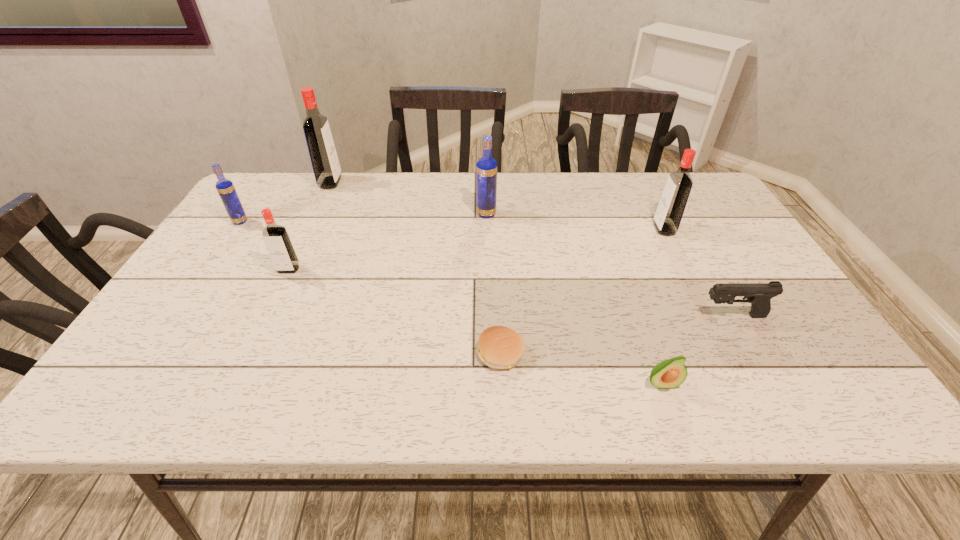
In order to click on empty location between the green avocado and the second biggest red vodka in this screenshot , I will do `click(662, 306)`.

At what (x,y) coordinates should I click in order to perform the action: click on vacant space that is in between the rightmost vodka and the pistol. Please return your answer as a coordinate pair (x, y). The height and width of the screenshot is (540, 960). Looking at the image, I should click on (698, 272).

Find the location of a particular element. The width and height of the screenshot is (960, 540). vacant region between the right blue vodka and the smaller blue vodka is located at coordinates (363, 218).

At what (x,y) coordinates should I click in order to perform the action: click on vacant point located between the leftmost object and the second farthest red vodka. Please return your answer as a coordinate pair (x, y). The width and height of the screenshot is (960, 540). Looking at the image, I should click on (452, 225).

The width and height of the screenshot is (960, 540). Identify the location of empty space between the third nearest object and the tallest object. (532, 249).

Point out which object is positioned as the seventh nearest to the green avocado. Please provide its 2D coordinates. Your answer should be formatted as a tuple, i.e. [(x, y)], where the tuple contains the x and y coordinates of a point satisfying the conditions above.

[(226, 190)]

Identify the location of object that is the seventh closest to the fifth farthest object. (759, 295).

Locate an element on the screen. Image resolution: width=960 pixels, height=540 pixels. the fifth closest vodka to the patty is located at coordinates (226, 190).

Choose which vodka is the fourth nearest neighbor to the leftmost vodka. Please provide its 2D coordinates. Your answer should be formatted as a tuple, i.e. [(x, y)], where the tuple contains the x and y coordinates of a point satisfying the conditions above.

[(669, 213)]

Choose which red vodka is the nearest neighbor to the tallest object. Please provide its 2D coordinates. Your answer should be formatted as a tuple, i.e. [(x, y)], where the tuple contains the x and y coordinates of a point satisfying the conditions above.

[(277, 241)]